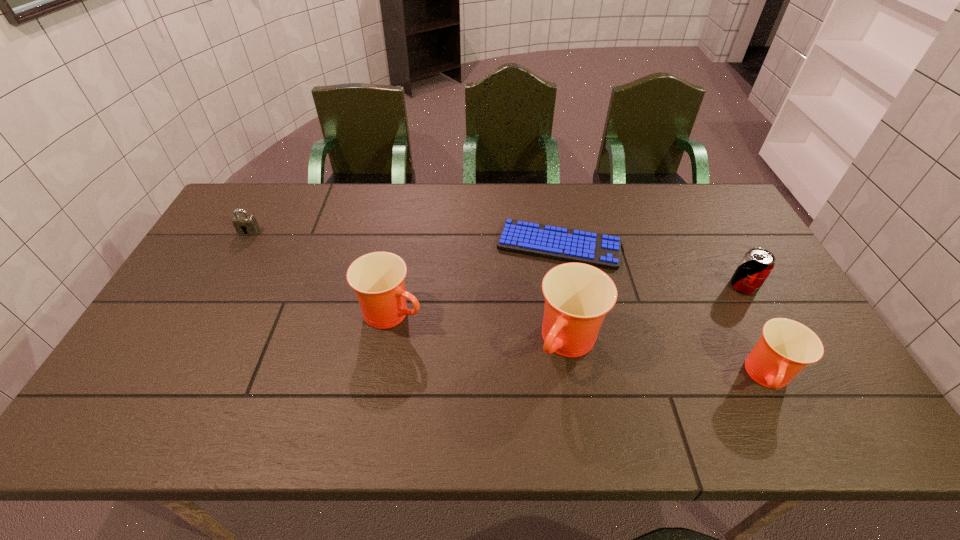
The cups are evenly distributed in the image. To maintain this, where would you place another cup on the left? Please point to a free space. Please provide its 2D coordinates. Your answer should be formatted as a tuple, i.e. [(x, y)], where the tuple contains the x and y coordinates of a point satisfying the conditions above.

[(235, 286)]